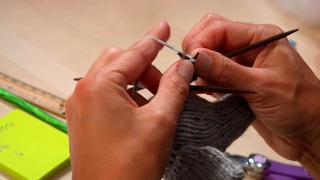
Locate an element on the screen. sticky notepad is located at coordinates (36, 144).